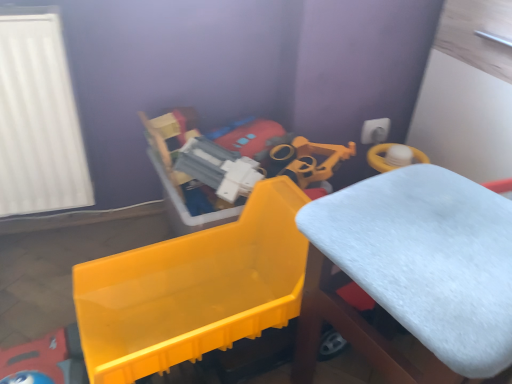
Question: Does point (415, 326) appear closer or farther from the camera than point (260, 215)?

Choices:
 (A) farther
 (B) closer

Answer: (B)

Question: Is white fluffy cushion at center situated inside shiny plastic toy at left or outside?

Choices:
 (A) outside
 (B) inside

Answer: (A)

Question: Based on their sizes in the image, would you say white fluffy cushion at center is bigger or smaller than shiny plastic toy at left?

Choices:
 (A) big
 (B) small

Answer: (A)

Question: From the image's perspective, relative to white fluffy cushion at center, is shiny plastic toy at left above or below?

Choices:
 (A) below
 (B) above

Answer: (B)

Question: In terms of width, does shiny plastic toy at left look wider or thinner when compared to white fluffy cushion at center?

Choices:
 (A) thin
 (B) wide

Answer: (A)

Question: Relative to white fluffy cushion at center, is shiny plastic toy at left in front or behind?

Choices:
 (A) behind
 (B) front

Answer: (A)

Question: Considering the positions of point (272, 286) and point (397, 241), is point (272, 286) closer or farther from the camera than point (397, 241)?

Choices:
 (A) closer
 (B) farther

Answer: (B)